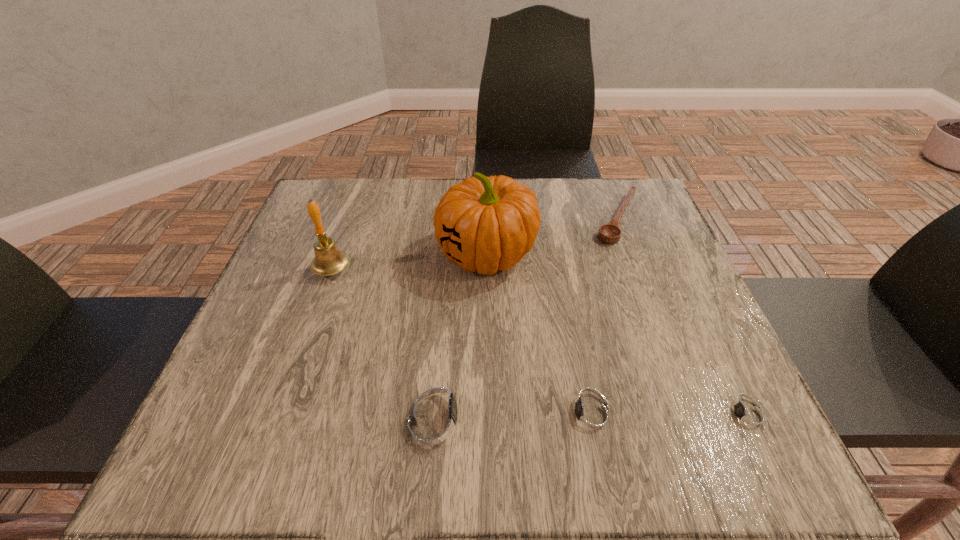
You are a GUI agent. You are given a task and a screenshot of the screen. Output one action in this format:
    pyautogui.click(x=<x>, y=<y>)
    Task: Click on the vacant space located on the face of the second shortest watch
    The height and width of the screenshot is (540, 960).
    Given the screenshot: What is the action you would take?
    pyautogui.click(x=492, y=415)

At what (x,y) coordinates should I click in order to perform the action: click on vacant space located 0.190m on the face of the second shortest watch. Please return your answer as a coordinate pair (x, y). The image size is (960, 540). Looking at the image, I should click on (437, 415).

Where is `vacant space positioned 0.090m on the face of the shortest watch`? This screenshot has width=960, height=540. vacant space positioned 0.090m on the face of the shortest watch is located at coordinates [x=662, y=415].

Where is `vacant space located on the face of the shortest watch`? The width and height of the screenshot is (960, 540). vacant space located on the face of the shortest watch is located at coordinates (546, 415).

In order to click on blank space located 0.250m on the face of the shortest watch in this screenshot , I will do `click(564, 415)`.

This screenshot has width=960, height=540. In order to click on free space located on the back of the wooden spoon in this screenshot , I will do `click(604, 181)`.

This screenshot has height=540, width=960. Identify the location of vacant position located on the surface of the pumpkin. (357, 254).

This screenshot has width=960, height=540. In order to click on vacant region located on the surface of the pumpkin in this screenshot , I will do `click(388, 254)`.

Locate an element on the screen. vacant space situated 0.170m on the surface of the pumpkin is located at coordinates (362, 254).

At what (x,y) coordinates should I click in order to perform the action: click on free space located on the front of the bell. Please return your answer as a coordinate pair (x, y). Image resolution: width=960 pixels, height=540 pixels. Looking at the image, I should click on (317, 315).